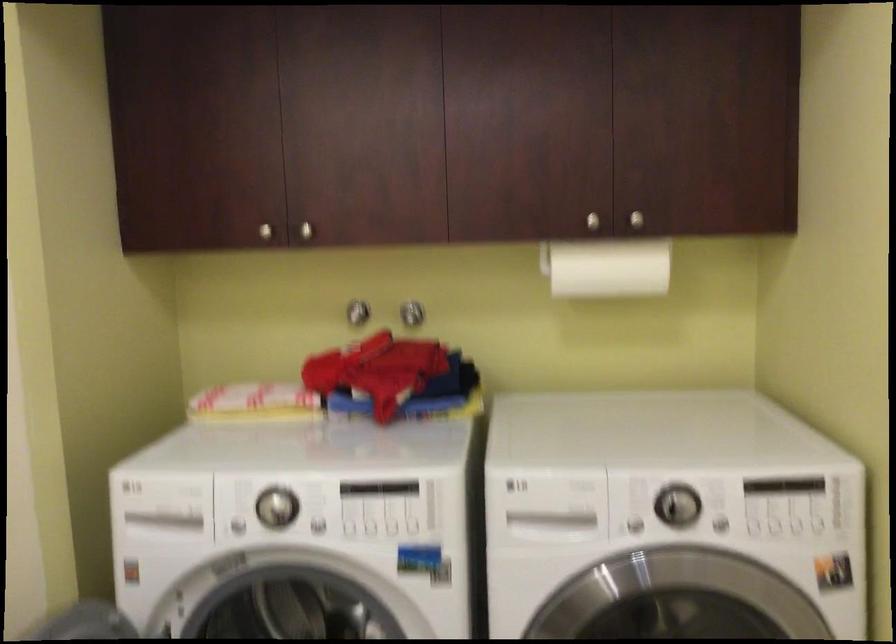
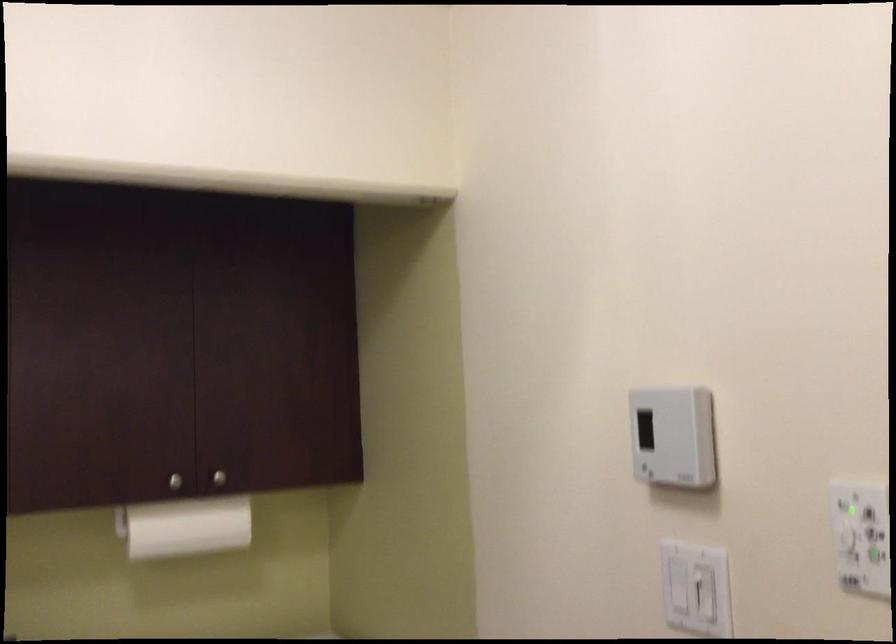
The point at (x=638, y=218) is marked in the first image. Where is the corresponding point in the second image?

(219, 478)